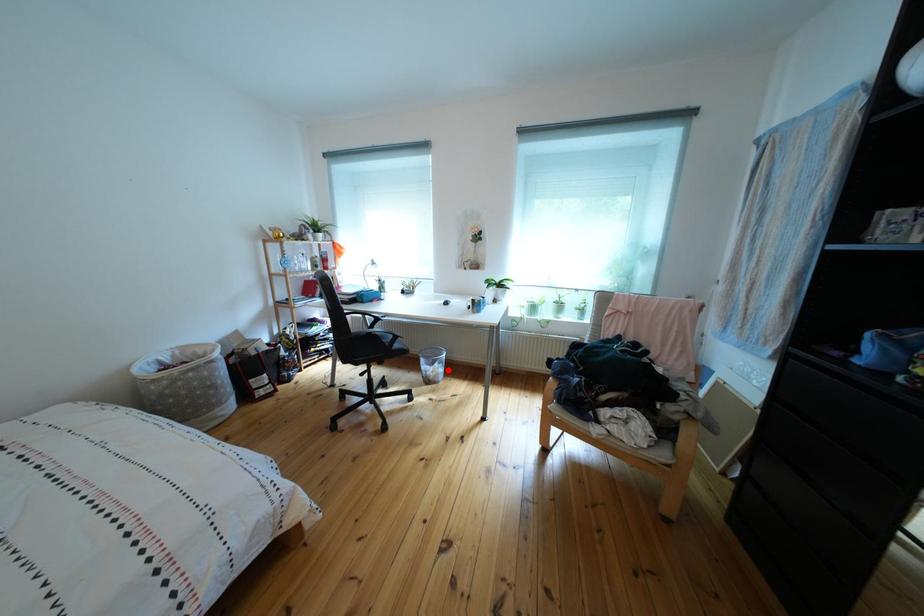
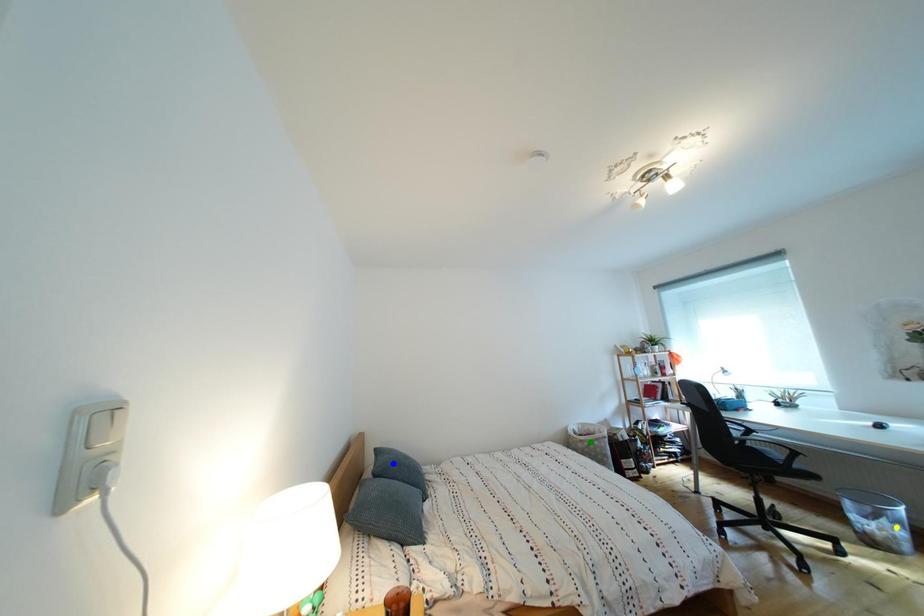
Question: I am providing you with two images of the same scene from different viewpoints. A red point is marked on the first image. You are given multiple points on the second image. Which spot in image 2 lines up with the point in image 1?

Choices:
 (A) blue point
 (B) yellow point
 (C) green point

Answer: (B)